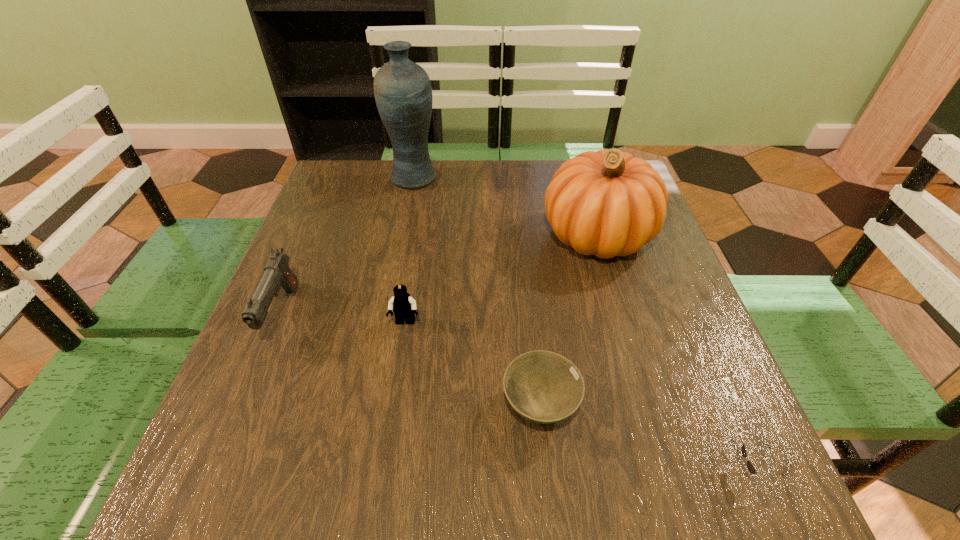
Where is `vacant space at the near right corner`? vacant space at the near right corner is located at coordinates (695, 500).

Find the location of `vacant point located between the vase and the fifth tallest object`. vacant point located between the vase and the fifth tallest object is located at coordinates (477, 292).

Identify the location of vacant space that's between the bowl and the pumpkin. The image size is (960, 540). (568, 320).

Image resolution: width=960 pixels, height=540 pixels. Identify the location of unoccupied position between the leftmost object and the second shortest object. (411, 360).

At what (x,y) coordinates should I click in order to perform the action: click on unoccupied position between the leftmost object and the bowl. Please return your answer as a coordinate pair (x, y). Looking at the image, I should click on (411, 360).

Locate an element on the screen. vacant area that lies between the fifth shortest object and the sunglasses is located at coordinates (674, 353).

Find the location of a particular element. This screenshot has height=540, width=960. free space between the bowl and the Lego is located at coordinates (472, 364).

You are a GUI agent. You are given a task and a screenshot of the screen. Output one action in this format:
    pyautogui.click(x=<x>, y=<y>)
    Task: Click on the vacant space that's between the tallest object and the sunglasses
    Image resolution: width=960 pixels, height=540 pixels.
    Given the screenshot: What is the action you would take?
    pyautogui.click(x=583, y=324)

This screenshot has width=960, height=540. I want to click on free space between the fourth tallest object and the second shortest object, so click(472, 364).

Locate an element on the screen. This screenshot has height=540, width=960. free space that is in between the fourth shortest object and the tallest object is located at coordinates (348, 246).